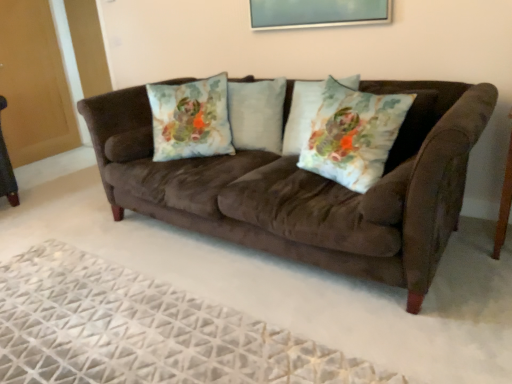
The width and height of the screenshot is (512, 384). Identify the location of free space between suede couch at center and brown wood side table at right. (480, 285).